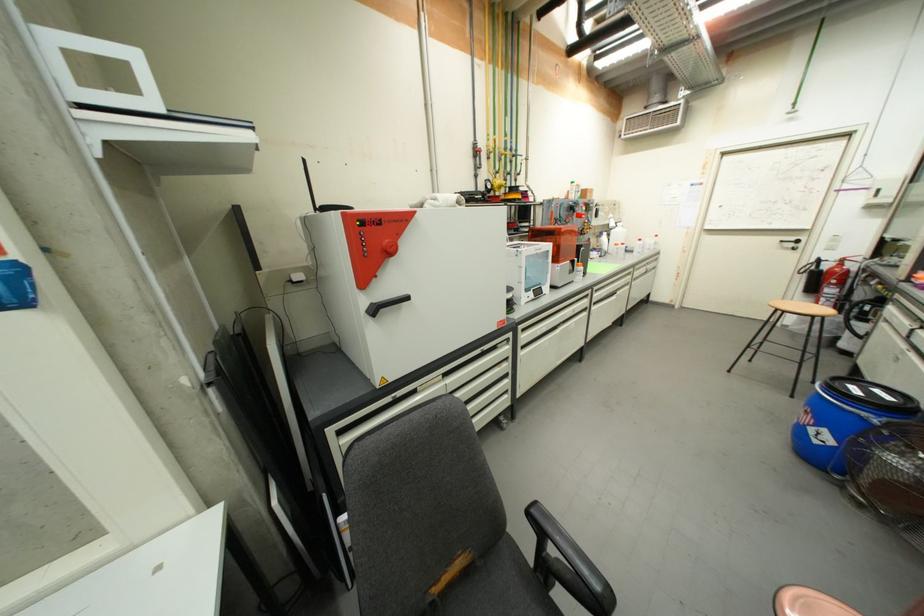
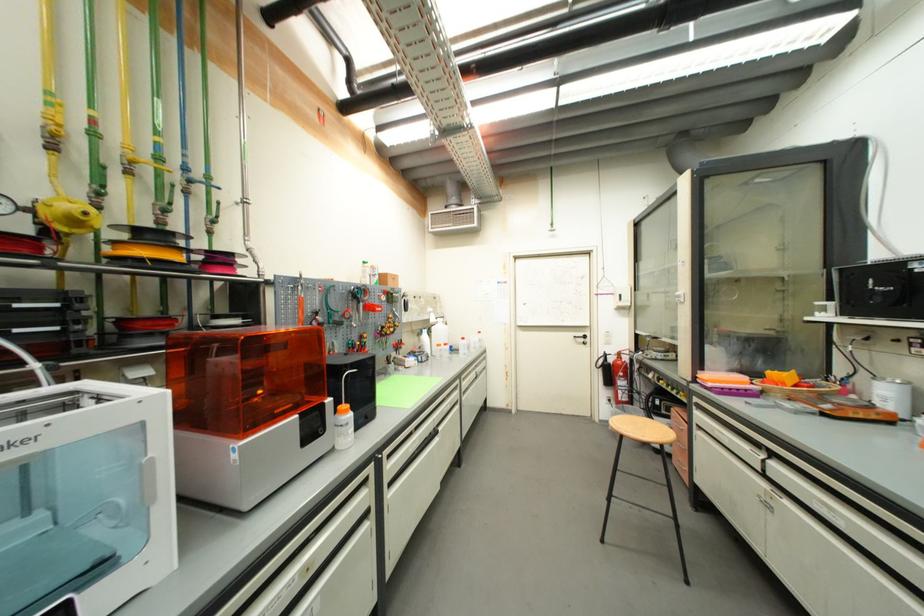
In the second image, find the point that corresponds to point (521, 176) in the first image.

(213, 222)